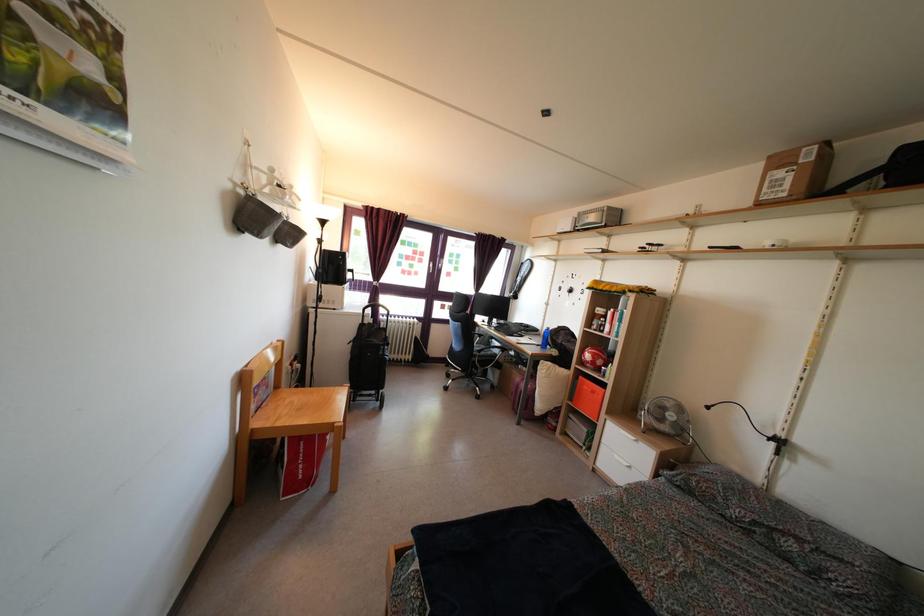
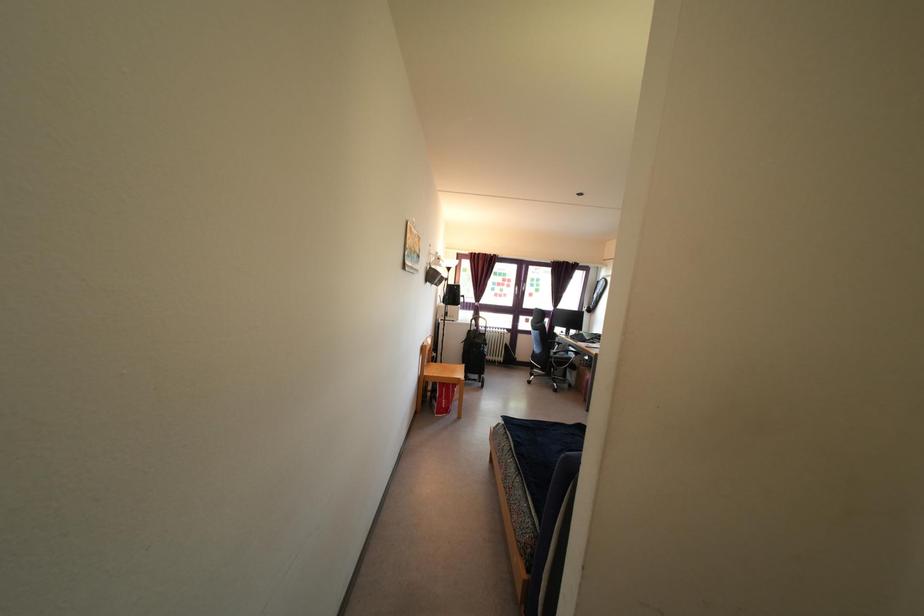
Question: In a continuous first-person perspective shot, in which direction is the camera moving?

Choices:
 (A) Left
 (B) Right
 (C) Forward
 (D) Backward

Answer: (D)